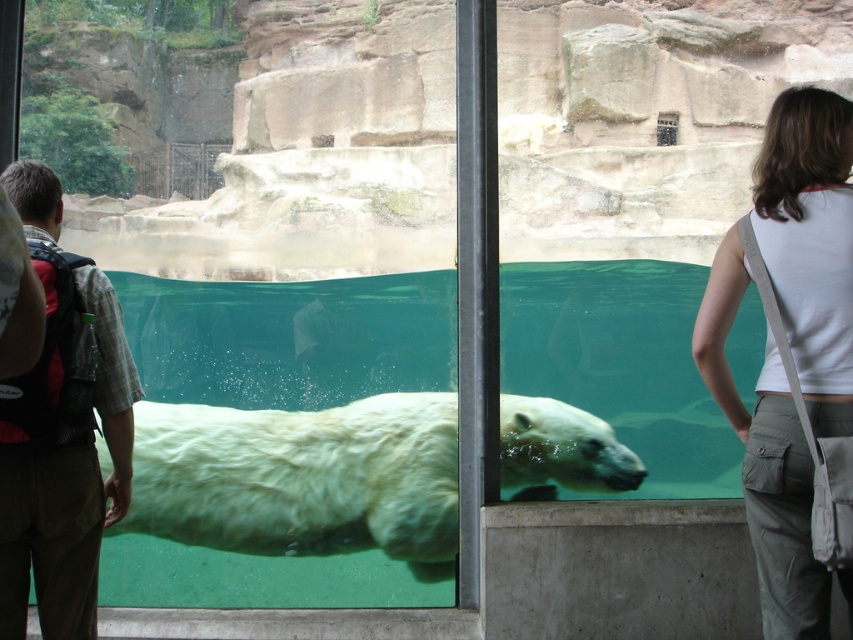
Question: Which of the following is the farthest from the observer?

Choices:
 (A) white fluffy polar bear at center
 (B) white cotton tank top at right
 (C) plaid shirt at left

Answer: (A)

Question: Among these objects, which one is nearest to the camera?

Choices:
 (A) white cotton tank top at right
 (B) plaid shirt at left
 (C) white fluffy polar bear at center

Answer: (A)

Question: Is white fluffy polar bear at center smaller than white cotton tank top at right?

Choices:
 (A) yes
 (B) no

Answer: (B)

Question: Which of the following is the closest to the observer?

Choices:
 (A) plaid shirt at left
 (B) white cotton tank top at right
 (C) white fluffy polar bear at center

Answer: (B)

Question: Observing the image, what is the correct spatial positioning of white fluffy polar bear at center in reference to white cotton tank top at right?

Choices:
 (A) above
 (B) below

Answer: (B)

Question: Is white fluffy polar bear at center smaller than plaid shirt at left?

Choices:
 (A) no
 (B) yes

Answer: (A)